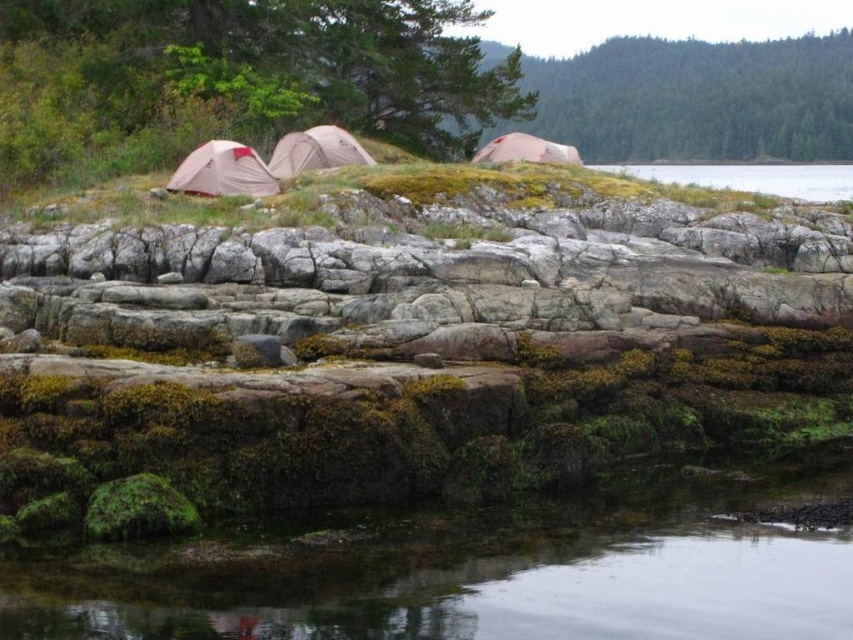
Question: Is matte pink tent at left wider than matte gray tent at center?

Choices:
 (A) yes
 (B) no

Answer: (B)

Question: Is clear water at lower right closer to the viewer compared to matte gray tent at center?

Choices:
 (A) no
 (B) yes

Answer: (A)

Question: Estimate the real-world distances between objects in this image. Which object is closer to the matte gray tent at center?

Choices:
 (A) matte pink tent at center
 (B) clear water at lower center
 (C) matte pink tent at left
 (D) clear water at lower right

Answer: (C)

Question: Which point is farther to the camera?

Choices:
 (A) (488, 161)
 (B) (299, 141)
 (C) (165, 188)

Answer: (A)

Question: Which of the following is the farthest from the observer?

Choices:
 (A) matte pink tent at center
 (B) clear water at lower center
 (C) clear water at lower right

Answer: (A)

Question: From the image, what is the correct spatial relationship of clear water at lower right in relation to matte pink tent at center?

Choices:
 (A) right
 (B) left

Answer: (A)